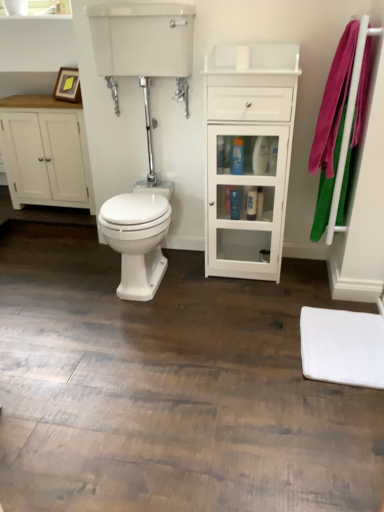
This screenshot has width=384, height=512. I want to click on empty space that is in between white glossy bidet at center and white glossy cabinet at center, so click(x=201, y=286).